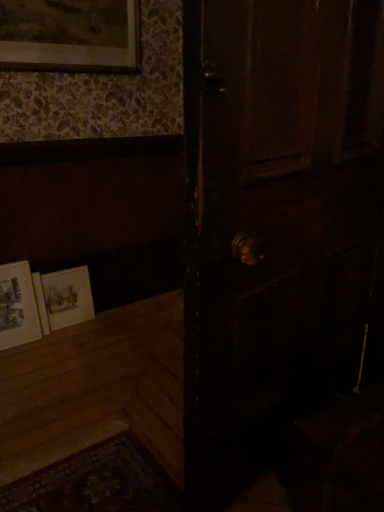
Where is `matte paper picture frame at lower left, the 1th picture frame in the bottom-to-top sequence`? This screenshot has height=512, width=384. matte paper picture frame at lower left, the 1th picture frame in the bottom-to-top sequence is located at coordinates (17, 306).

Which object is more forward, matte paper picture frame at lower left, which is the third picture frame from top to bottom, or matte white picture frame at lower left, the second picture frame in the bottom-to-top sequence?

matte paper picture frame at lower left, which is the third picture frame from top to bottom, is in front.

Could you tell me if matte paper picture frame at lower left, which is the third picture frame from top to bottom, is facing matte white picture frame at lower left, arranged as the 2th picture frame when viewed from the top?

No, matte paper picture frame at lower left, which is the third picture frame from top to bottom, does not turn towards matte white picture frame at lower left, arranged as the 2th picture frame when viewed from the top.

Which point is more distant from viewer, (36, 305) or (79, 296)?

The point (79, 296) is behind.

From the image's perspective, who appears lower, matte paper picture frame at lower left, the 1th picture frame in the bottom-to-top sequence, or matte white picture frame at lower left, the second picture frame in the bottom-to-top sequence?

matte paper picture frame at lower left, the 1th picture frame in the bottom-to-top sequence, appears lower in the image.

Can you tell me how much matte gold picture frame at upper left, which is the 1th picture frame from top to bottom, and dark wood door at center differ in facing direction?

167 degrees.

Between matte gold picture frame at upper left, which is the 1th picture frame from top to bottom, and dark wood door at center, which one has more height?

Standing taller between the two is dark wood door at center.

Is matte gold picture frame at upper left, which is the 1th picture frame from top to bottom, far away from dark wood door at center?

Yes, matte gold picture frame at upper left, which is the 1th picture frame from top to bottom, and dark wood door at center are quite far apart.

How far apart are matte gold picture frame at upper left, which is the 1th picture frame from top to bottom, and dark wood door at center?

matte gold picture frame at upper left, which is the 1th picture frame from top to bottom, and dark wood door at center are 4.87 feet apart from each other.

Is point (276, 116) positioned behind point (32, 298)?

No, it is not.

Does dark wood door at center appear on the left side of matte paper picture frame at lower left, which is the third picture frame from top to bottom?

No, dark wood door at center is not to the left of matte paper picture frame at lower left, which is the third picture frame from top to bottom.

Based on their sizes in the image, would you say dark wood door at center is bigger or smaller than matte paper picture frame at lower left, which is the third picture frame from top to bottom?

Considering their sizes, dark wood door at center takes up more space than matte paper picture frame at lower left, which is the third picture frame from top to bottom.

Based on their sizes in the image, would you say matte white picture frame at lower left, arranged as the 2th picture frame when viewed from the top, is bigger or smaller than matte paper picture frame at lower left, which is the third picture frame from top to bottom?

Considering their sizes, matte white picture frame at lower left, arranged as the 2th picture frame when viewed from the top, takes up less space than matte paper picture frame at lower left, which is the third picture frame from top to bottom.

Would you say matte white picture frame at lower left, the second picture frame in the bottom-to-top sequence, is outside matte paper picture frame at lower left, the 1th picture frame in the bottom-to-top sequence?

Yes.

Between matte white picture frame at lower left, the second picture frame in the bottom-to-top sequence, and matte paper picture frame at lower left, which is the third picture frame from top to bottom, which one has smaller width?

matte white picture frame at lower left, the second picture frame in the bottom-to-top sequence.

Considering the sizes of matte white picture frame at lower left, the second picture frame in the bottom-to-top sequence, and matte paper picture frame at lower left, which is the third picture frame from top to bottom, in the image, is matte white picture frame at lower left, the second picture frame in the bottom-to-top sequence, taller or shorter than matte paper picture frame at lower left, which is the third picture frame from top to bottom,?

Considering their sizes, matte white picture frame at lower left, the second picture frame in the bottom-to-top sequence, has less height than matte paper picture frame at lower left, which is the third picture frame from top to bottom.

Based on their sizes in the image, would you say matte gold picture frame at upper left, which is the 1th picture frame from top to bottom, is bigger or smaller than matte white picture frame at lower left, the second picture frame in the bottom-to-top sequence?

Considering their sizes, matte gold picture frame at upper left, which is the 1th picture frame from top to bottom, takes up more space than matte white picture frame at lower left, the second picture frame in the bottom-to-top sequence.

From a real-world perspective, is matte gold picture frame at upper left, the 3th picture frame from the bottom, beneath matte white picture frame at lower left, the second picture frame in the bottom-to-top sequence?

No, from a real-world perspective, matte gold picture frame at upper left, the 3th picture frame from the bottom, is not under matte white picture frame at lower left, the second picture frame in the bottom-to-top sequence.

Consider the image. Is the surface of matte gold picture frame at upper left, the 3th picture frame from the bottom, in direct contact with matte white picture frame at lower left, the second picture frame in the bottom-to-top sequence?

matte gold picture frame at upper left, the 3th picture frame from the bottom, is not next to matte white picture frame at lower left, the second picture frame in the bottom-to-top sequence, and they're not touching.

Identify the location of the 1st picture frame counting from the left of the matte gold picture frame at upper left, the 3th picture frame from the bottom. The height and width of the screenshot is (512, 384). (67, 297).

Which of these two, matte white picture frame at lower left, the second picture frame in the bottom-to-top sequence, or matte gold picture frame at upper left, which is the 1th picture frame from top to bottom, stands taller?

Standing taller between the two is matte gold picture frame at upper left, which is the 1th picture frame from top to bottom.

Between matte white picture frame at lower left, arranged as the 2th picture frame when viewed from the top, and matte gold picture frame at upper left, the 3th picture frame from the bottom, which one appears on the right side from the viewer's perspective?

matte gold picture frame at upper left, the 3th picture frame from the bottom.

From the image's perspective, is matte white picture frame at lower left, the second picture frame in the bottom-to-top sequence, beneath matte gold picture frame at upper left, the 3th picture frame from the bottom?

Indeed, from the image's perspective, matte white picture frame at lower left, the second picture frame in the bottom-to-top sequence, is shown beneath matte gold picture frame at upper left, the 3th picture frame from the bottom.

Where is `picture frame located on the right of matte white picture frame at lower left, the second picture frame in the bottom-to-top sequence`? The height and width of the screenshot is (512, 384). picture frame located on the right of matte white picture frame at lower left, the second picture frame in the bottom-to-top sequence is located at coordinates (70, 35).

From the image's perspective, which one is positioned higher, matte gold picture frame at upper left, which is the 1th picture frame from top to bottom, or matte paper picture frame at lower left, which is the third picture frame from top to bottom?

matte gold picture frame at upper left, which is the 1th picture frame from top to bottom.

Can you confirm if matte gold picture frame at upper left, which is the 1th picture frame from top to bottom, is positioned to the right of matte paper picture frame at lower left, which is the third picture frame from top to bottom?

Yes, matte gold picture frame at upper left, which is the 1th picture frame from top to bottom, is to the right of matte paper picture frame at lower left, which is the third picture frame from top to bottom.

Which of these two, matte gold picture frame at upper left, the 3th picture frame from the bottom, or matte paper picture frame at lower left, which is the third picture frame from top to bottom, stands taller?

Standing taller between the two is matte paper picture frame at lower left, which is the third picture frame from top to bottom.

Which is in front, point (138, 3) or point (26, 301)?

Positioned in front is point (138, 3).

Locate an element on the screen. The image size is (384, 512). picture frame beneath the matte paper picture frame at lower left, which is the third picture frame from top to bottom (from a real-world perspective) is located at coordinates (67, 297).

This screenshot has height=512, width=384. Identify the location of picture frame that appears above the dark wood door at center (from the image's perspective). (70, 35).

When comparing their distances from matte gold picture frame at upper left, the 3th picture frame from the bottom, does matte paper picture frame at lower left, which is the third picture frame from top to bottom, or matte white picture frame at lower left, arranged as the 2th picture frame when viewed from the top, seem closer?

matte paper picture frame at lower left, which is the third picture frame from top to bottom.

Looking at this image, based on their spatial positions, is matte white picture frame at lower left, the second picture frame in the bottom-to-top sequence, or dark wood door at center further from matte paper picture frame at lower left, the 1th picture frame in the bottom-to-top sequence?

The object further to matte paper picture frame at lower left, the 1th picture frame in the bottom-to-top sequence, is dark wood door at center.

Estimate the real-world distances between objects in this image. Which object is further from dark wood door at center, matte gold picture frame at upper left, which is the 1th picture frame from top to bottom, or matte paper picture frame at lower left, which is the third picture frame from top to bottom?

matte paper picture frame at lower left, which is the third picture frame from top to bottom, is further to dark wood door at center.

Looking at the image, which one is located further to matte gold picture frame at upper left, which is the 1th picture frame from top to bottom, matte white picture frame at lower left, the second picture frame in the bottom-to-top sequence, or matte paper picture frame at lower left, which is the third picture frame from top to bottom?

Based on the image, matte white picture frame at lower left, the second picture frame in the bottom-to-top sequence, appears to be further to matte gold picture frame at upper left, which is the 1th picture frame from top to bottom.

Looking at the image, which one is located further to matte paper picture frame at lower left, which is the third picture frame from top to bottom, matte gold picture frame at upper left, the 3th picture frame from the bottom, or dark wood door at center?

dark wood door at center lies further to matte paper picture frame at lower left, which is the third picture frame from top to bottom, than the other object.

Consider the image. From the image, which object appears to be farther from dark wood door at center, matte white picture frame at lower left, the second picture frame in the bottom-to-top sequence, or matte gold picture frame at upper left, which is the 1th picture frame from top to bottom?

matte gold picture frame at upper left, which is the 1th picture frame from top to bottom, lies further to dark wood door at center than the other object.

Which object lies nearer to the anchor point matte white picture frame at lower left, the second picture frame in the bottom-to-top sequence, matte gold picture frame at upper left, which is the 1th picture frame from top to bottom, or matte paper picture frame at lower left, the 1th picture frame in the bottom-to-top sequence?

matte paper picture frame at lower left, the 1th picture frame in the bottom-to-top sequence, is positioned closer to the anchor matte white picture frame at lower left, the second picture frame in the bottom-to-top sequence.

From the image, which object appears to be nearer to matte gold picture frame at upper left, the 3th picture frame from the bottom, dark wood door at center or matte white picture frame at lower left, arranged as the 2th picture frame when viewed from the top?

The object closer to matte gold picture frame at upper left, the 3th picture frame from the bottom, is matte white picture frame at lower left, arranged as the 2th picture frame when viewed from the top.

This screenshot has height=512, width=384. I want to click on picture frame between dark wood door at center and matte paper picture frame at lower left, which is the third picture frame from top to bottom, from front to back, so click(x=70, y=35).

Find the location of `picture frame between matte gold picture frame at upper left, which is the 1th picture frame from top to bottom, and matte paper picture frame at lower left, the 1th picture frame in the bottom-to-top sequence, in the up-down direction`. picture frame between matte gold picture frame at upper left, which is the 1th picture frame from top to bottom, and matte paper picture frame at lower left, the 1th picture frame in the bottom-to-top sequence, in the up-down direction is located at coordinates (67, 297).